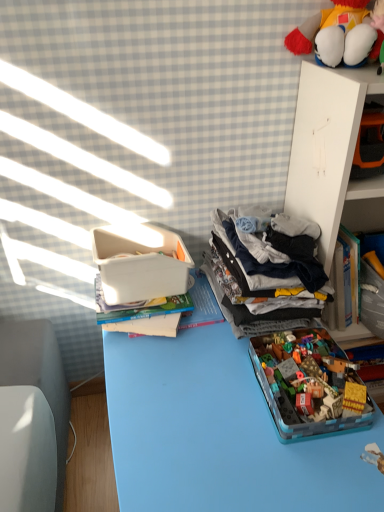
Measure the distance between translucent plastic container at center, which is the second toy in top-to-bottom order, and camera.

The distance of translucent plastic container at center, which is the second toy in top-to-bottom order, from camera is 81.56 centimeters.

Where is `fluffy plush toy at upper right, which ranks as the second toy in bottom-to-top order`? The width and height of the screenshot is (384, 512). fluffy plush toy at upper right, which ranks as the second toy in bottom-to-top order is located at coordinates (341, 33).

This screenshot has width=384, height=512. Find the location of `dark gray cotton clothes at center right`. dark gray cotton clothes at center right is located at coordinates (268, 277).

You are a GUI agent. You are given a task and a screenshot of the screen. Output one action in this format:
    pyautogui.click(x=<x>, y=<y>)
    Task: Click on the translucent plastic container at center, the first toy ordered from the bottom
    
    Given the screenshot: What is the action you would take?
    pyautogui.click(x=307, y=383)

Is dark gray cotton clothes at center right bigger or smaller than white plastic container at upper left?

Considering their sizes, dark gray cotton clothes at center right takes up less space than white plastic container at upper left.

Locate an element on the screen. clothing on the right of white plastic container at upper left is located at coordinates (268, 277).

Can we say dark gray cotton clothes at center right lies outside white plastic container at upper left?

Absolutely, dark gray cotton clothes at center right is external to white plastic container at upper left.

Considering the sizes of objects white cardboard at upper right and translucent plastic container at center, the first toy ordered from the bottom, in the image provided, who is taller, white cardboard at upper right or translucent plastic container at center, the first toy ordered from the bottom,?

white cardboard at upper right is taller.

Consider the image. Is white cardboard at upper right in front of or behind translucent plastic container at center, which is the second toy in top-to-bottom order, in the image?

In the image, white cardboard at upper right appears behind translucent plastic container at center, which is the second toy in top-to-bottom order.

From the picture: Measure the distance from white cardboard at upper right to translucent plastic container at center, which is the second toy in top-to-bottom order.

A distance of 14.32 inches exists between white cardboard at upper right and translucent plastic container at center, which is the second toy in top-to-bottom order.

Is translucent plastic container at center, the first toy ordered from the bottom, at the back of white cardboard at upper right?

No, translucent plastic container at center, the first toy ordered from the bottom, is not at the back of white cardboard at upper right.

From the picture: Which of these two, white cardboard at upper right or dark gray cotton clothes at center right, is wider?

Wider between the two is dark gray cotton clothes at center right.

Which object is further away from the camera taking this photo, white cardboard at upper right or dark gray cotton clothes at center right?

dark gray cotton clothes at center right is behind.

Can we say white cardboard at upper right lies outside dark gray cotton clothes at center right?

Yes, white cardboard at upper right is outside of dark gray cotton clothes at center right.

Which point is more forward, [348,86] or [255,254]?

The point [348,86] is in front.

Are white cardboard at upper right and white plastic container at upper left beside each other?

No, white cardboard at upper right is not touching white plastic container at upper left.

Between white cardboard at upper right and white plastic container at upper left, which one has more height?

white cardboard at upper right is taller.

Can you confirm if white cardboard at upper right is positioned to the left of white plastic container at upper left?

No.

From the image's perspective, is white cardboard at upper right below white plastic container at upper left?

Yes.

How distant is translucent plastic container at center, the first toy ordered from the bottom, from white plastic container at upper left?

translucent plastic container at center, the first toy ordered from the bottom, and white plastic container at upper left are 11.37 inches apart.

Can you confirm if translucent plastic container at center, which is the second toy in top-to-bottom order, is bigger than white plastic container at upper left?

No, translucent plastic container at center, which is the second toy in top-to-bottom order, is not bigger than white plastic container at upper left.

Considering the relative positions of translucent plastic container at center, the first toy ordered from the bottom, and white plastic container at upper left in the image provided, is translucent plastic container at center, the first toy ordered from the bottom, to the left or to the right of white plastic container at upper left?

translucent plastic container at center, the first toy ordered from the bottom, is to the right of white plastic container at upper left.

Is translucent plastic container at center, which is the second toy in top-to-bottom order, located outside white plastic container at upper left?

Yes, translucent plastic container at center, which is the second toy in top-to-bottom order, is not within white plastic container at upper left.

Considering the relative sizes of white plastic container at upper left and white cardboard at upper right in the image provided, is white plastic container at upper left wider than white cardboard at upper right?

Correct, the width of white plastic container at upper left exceeds that of white cardboard at upper right.

Locate an element on the screen. desk directly beneath the white cardboard at upper right (from a real-world perspective) is located at coordinates [203, 297].

Is white plastic container at upper left located outside white cardboard at upper right?

Yes, white plastic container at upper left is outside of white cardboard at upper right.

Would you consider white plastic container at upper left to be distant from white cardboard at upper right?

No, white plastic container at upper left is in close proximity to white cardboard at upper right.

Based on the photo, does white cardboard at upper right contain fluffy plush toy at upper right, the 1th toy in the top-to-bottom sequence?

No.

Locate an element on the screen. The height and width of the screenshot is (512, 384). toy that appears above the white cardboard at upper right (from the image's perspective) is located at coordinates (341, 33).

Which object is positioned more to the right, white cardboard at upper right or fluffy plush toy at upper right, which ranks as the second toy in bottom-to-top order?

From the viewer's perspective, white cardboard at upper right appears more on the right side.

Based on the photo, from a real-world perspective, which is physically below, white cardboard at upper right or fluffy plush toy at upper right, which ranks as the second toy in bottom-to-top order?

white cardboard at upper right.

This screenshot has height=512, width=384. In order to click on desk that is on the left side of dark gray cotton clothes at center right in this screenshot , I will do `click(203, 297)`.

I want to click on toy that appears below the white cardboard at upper right (from a real-world perspective), so click(x=307, y=383).

Estimate the real-world distances between objects in this image. Which object is closer to dark gray cotton clothes at center right, translucent plastic container at center, the first toy ordered from the bottom, or fluffy plush toy at upper right, which ranks as the second toy in bottom-to-top order?

translucent plastic container at center, the first toy ordered from the bottom, is closer to dark gray cotton clothes at center right.

From the picture: Estimate the real-world distances between objects in this image. Which object is further from translucent plastic container at center, the first toy ordered from the bottom, fluffy plush toy at upper right, the 1th toy in the top-to-bottom sequence, or white plastic container at upper left?

The object further to translucent plastic container at center, the first toy ordered from the bottom, is fluffy plush toy at upper right, the 1th toy in the top-to-bottom sequence.

When comparing their distances from dark gray cotton clothes at center right, does white cardboard at upper right or white plastic container at upper left seem further?

Among the two, white cardboard at upper right is located further to dark gray cotton clothes at center right.

Which object lies nearer to the anchor point white plastic container at upper left, white cardboard at upper right or dark gray cotton clothes at center right?

dark gray cotton clothes at center right is closer to white plastic container at upper left.

When comparing their distances from dark gray cotton clothes at center right, does fluffy plush toy at upper right, the 1th toy in the top-to-bottom sequence, or translucent plastic container at center, the first toy ordered from the bottom, seem closer?

translucent plastic container at center, the first toy ordered from the bottom.

When comparing their distances from white plastic container at upper left, does white cardboard at upper right or fluffy plush toy at upper right, which ranks as the second toy in bottom-to-top order, seem closer?

The object closer to white plastic container at upper left is white cardboard at upper right.

Which object lies nearer to the anchor point dark gray cotton clothes at center right, white plastic container at upper left or white cardboard at upper right?

Among the two, white cardboard at upper right is located nearer to dark gray cotton clothes at center right.

Looking at the image, which one is located further to fluffy plush toy at upper right, which ranks as the second toy in bottom-to-top order, dark gray cotton clothes at center right or white plastic container at upper left?

white plastic container at upper left lies further to fluffy plush toy at upper right, which ranks as the second toy in bottom-to-top order, than the other object.

Locate an element on the screen. storage box between fluffy plush toy at upper right, the 1th toy in the top-to-bottom sequence, and white plastic container at upper left vertically is located at coordinates (140, 266).

Find the location of `clothing between white plastic container at upper left and white cardboard at upper right in the horizontal direction`. clothing between white plastic container at upper left and white cardboard at upper right in the horizontal direction is located at coordinates (268, 277).

Where is `shelf between dark gray cotton clothes at center right and white plastic container at upper left in the vertical direction`? shelf between dark gray cotton clothes at center right and white plastic container at upper left in the vertical direction is located at coordinates (332, 154).

I want to click on toy between fluffy plush toy at upper right, the 1th toy in the top-to-bottom sequence, and white plastic container at upper left in the up-down direction, so click(307, 383).